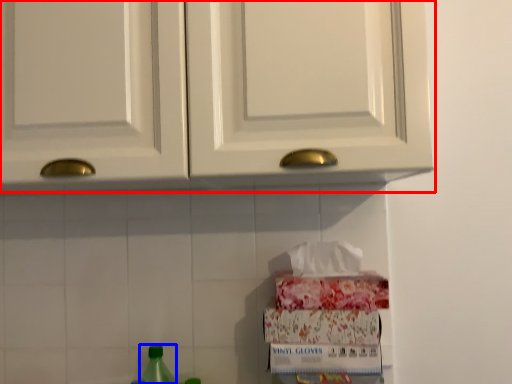
Question: Which object is further to the camera taking this photo, cabinetry (highlighted by a red box) or bottle (highlighted by a blue box)?

Choices:
 (A) cabinetry
 (B) bottle

Answer: (B)